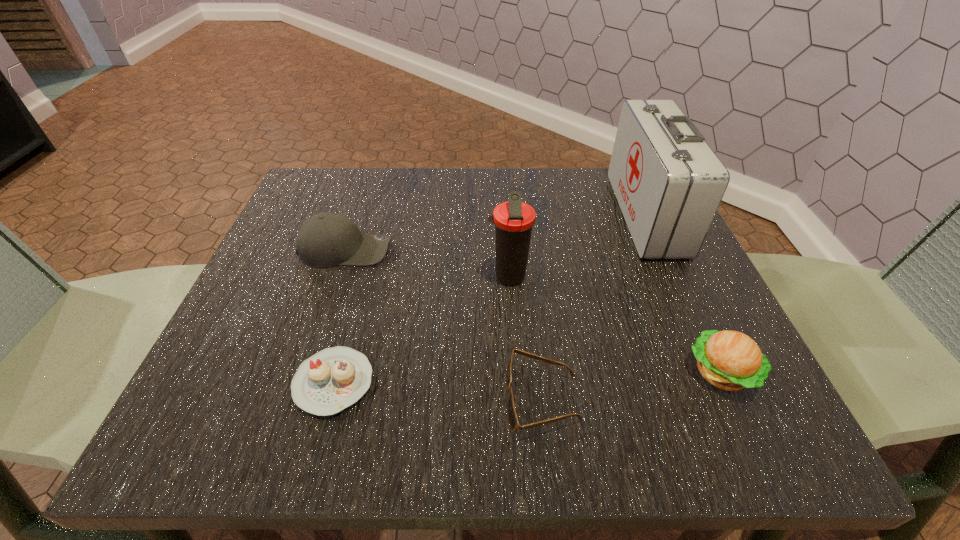
Identify the location of free space between the sunglasses and the first-aid kit. This screenshot has width=960, height=540. (593, 307).

I want to click on object that is the third closest to the cupcake, so click(513, 220).

In order to click on the third closest object relative to the baseball cap in this screenshot , I will do `click(511, 413)`.

The height and width of the screenshot is (540, 960). What are the coordinates of `vacant area that satisfies the following two spatial constraints: 1. on the front brim of the cupcake; 2. on the right side of the baseball cap` in the screenshot? It's located at (301, 382).

Find the location of a particular element. The image size is (960, 540). free location that satisfies the following two spatial constraints: 1. on the back side of the hamburger; 2. on the front-facing side of the first-aid kit is located at coordinates (648, 214).

You are a GUI agent. You are given a task and a screenshot of the screen. Output one action in this format:
    pyautogui.click(x=<x>, y=<y>)
    Task: Click on the free space that satisfies the following two spatial constraints: 1. on the back side of the second tallest object; 2. on the front brim of the baseball cap
    The image size is (960, 540).
    Given the screenshot: What is the action you would take?
    pyautogui.click(x=506, y=250)

At what (x,y) coordinates should I click in order to perform the action: click on vacant space that satisfies the following two spatial constraints: 1. on the front brim of the baseball cap; 2. on the back side of the hamburger. Please return your answer as a coordinate pair (x, y). The image size is (960, 540). Looking at the image, I should click on (304, 373).

Locate an element on the screen. vacant area that satisfies the following two spatial constraints: 1. on the front brim of the hamburger; 2. on the right side of the baseball cap is located at coordinates (304, 373).

Find the location of a particular element. vacant area that satisfies the following two spatial constraints: 1. on the back side of the cupcake; 2. on the left side of the thermos bottle is located at coordinates (363, 278).